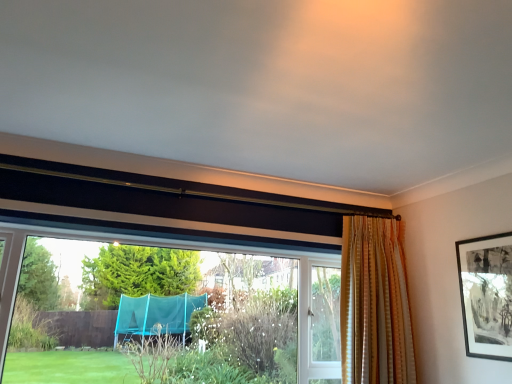
Question: Does transparent plastic trampoline at lower left contain striped fabric curtain at right?

Choices:
 (A) yes
 (B) no

Answer: (B)

Question: Does transparent plastic trampoline at lower left lie behind striped fabric curtain at right?

Choices:
 (A) no
 (B) yes

Answer: (A)

Question: Does transparent plastic trampoline at lower left appear on the left side of striped fabric curtain at right?

Choices:
 (A) no
 (B) yes

Answer: (B)

Question: Considering the relative sizes of transparent plastic trampoline at lower left and striped fabric curtain at right in the image provided, is transparent plastic trampoline at lower left shorter than striped fabric curtain at right?

Choices:
 (A) yes
 (B) no

Answer: (A)

Question: Is transparent plastic trampoline at lower left smaller than striped fabric curtain at right?

Choices:
 (A) no
 (B) yes

Answer: (A)

Question: From the image's perspective, is transparent plastic trampoline at lower left on top of striped fabric curtain at right?

Choices:
 (A) yes
 (B) no

Answer: (B)

Question: Does black matte picture frame at upper right have a greater height compared to striped fabric curtain at right?

Choices:
 (A) yes
 (B) no

Answer: (B)

Question: From the image's perspective, is black matte picture frame at upper right located beneath striped fabric curtain at right?

Choices:
 (A) yes
 (B) no

Answer: (B)

Question: Does black matte picture frame at upper right have a greater width compared to striped fabric curtain at right?

Choices:
 (A) no
 (B) yes

Answer: (A)

Question: Does black matte picture frame at upper right appear on the right side of striped fabric curtain at right?

Choices:
 (A) yes
 (B) no

Answer: (A)

Question: Is black matte picture frame at upper right oriented towards striped fabric curtain at right?

Choices:
 (A) no
 (B) yes

Answer: (A)

Question: Considering the relative positions of black matte picture frame at upper right and striped fabric curtain at right in the image provided, is black matte picture frame at upper right in front of striped fabric curtain at right?

Choices:
 (A) no
 (B) yes

Answer: (B)

Question: Does transparent plastic trampoline at lower left lie behind black matte picture frame at upper right?

Choices:
 (A) yes
 (B) no

Answer: (B)